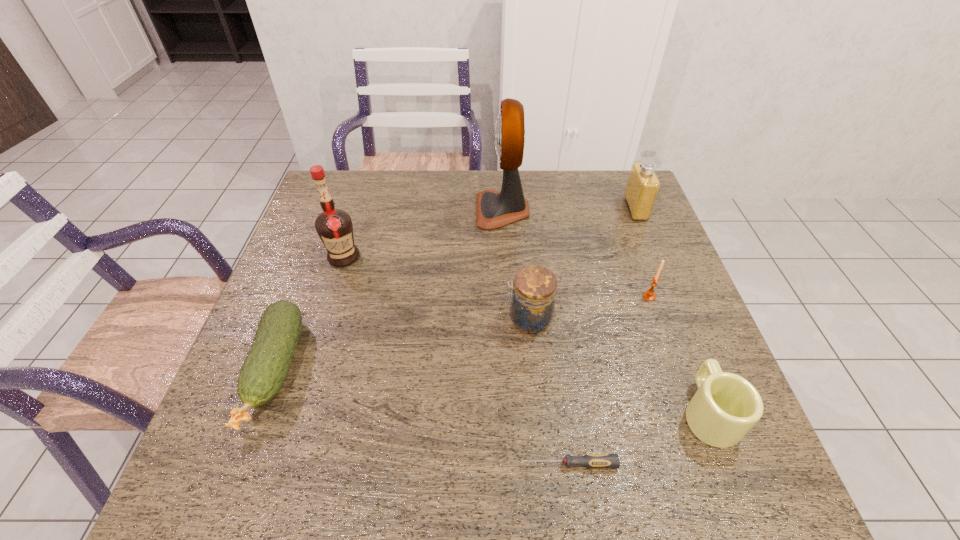
You are a GUI agent. You are given a task and a screenshot of the screen. Output one action in this format:
    pyautogui.click(x=<x>, y=<y>)
    Task: Click on the free space located on the front-facing side of the fan
    The image size is (960, 540).
    Given the screenshot: What is the action you would take?
    coord(437,210)

At what (x,y) coordinates should I click in order to perform the action: click on free space located on the front-facing side of the fan. Please return your answer as a coordinate pair (x, y). Image resolution: width=960 pixels, height=540 pixels. Looking at the image, I should click on (372, 210).

Find the location of `free space located 0.090m on the front-facing side of the fan`. free space located 0.090m on the front-facing side of the fan is located at coordinates (446, 210).

Where is `vacant space situated 0.330m on the front and back of the liquor`? Image resolution: width=960 pixels, height=540 pixels. vacant space situated 0.330m on the front and back of the liquor is located at coordinates (305, 378).

The height and width of the screenshot is (540, 960). I want to click on vacant space located on the front-facing side of the sixth shortest object, so click(x=601, y=209).

The height and width of the screenshot is (540, 960). Find the location of `blank area located on the front-facing side of the sixth shortest object`. blank area located on the front-facing side of the sixth shortest object is located at coordinates (552, 209).

The height and width of the screenshot is (540, 960). What are the coordinates of `vacant space located 0.290m on the front-facing side of the sixth shortest object` in the screenshot? It's located at (532, 209).

Image resolution: width=960 pixels, height=540 pixels. I want to click on vacant region located 0.370m on the lid of the jar, so [x=349, y=319].

This screenshot has height=540, width=960. Identify the location of free space located 0.190m on the lid of the jar. (424, 319).

This screenshot has height=540, width=960. I want to click on vacant space situated on the lid of the jar, so click(442, 319).